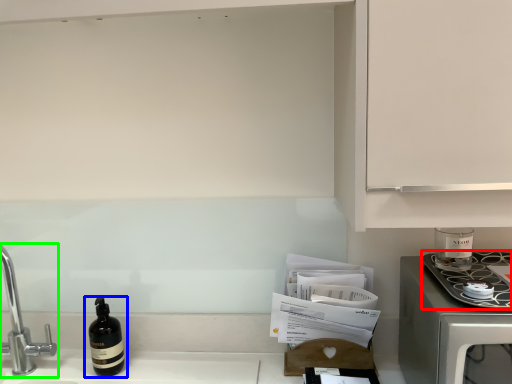
Question: Which object is the farthest from kitchen appliance (highlighted by a red box)? Choose among these: bottle (highlighted by a blue box) or tap (highlighted by a green box).

Choices:
 (A) bottle
 (B) tap

Answer: (B)